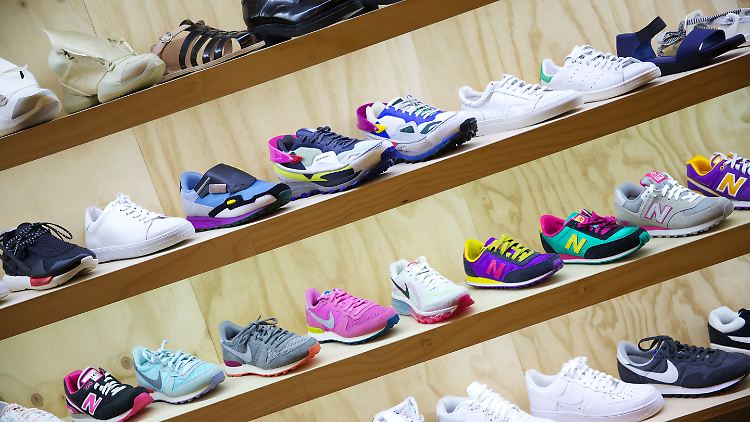
The image size is (750, 422). What are the coordinates of `shoes on 4th (bottom) shelf` in the screenshot? It's located at (735, 331), (690, 362), (618, 391), (501, 411), (406, 411).